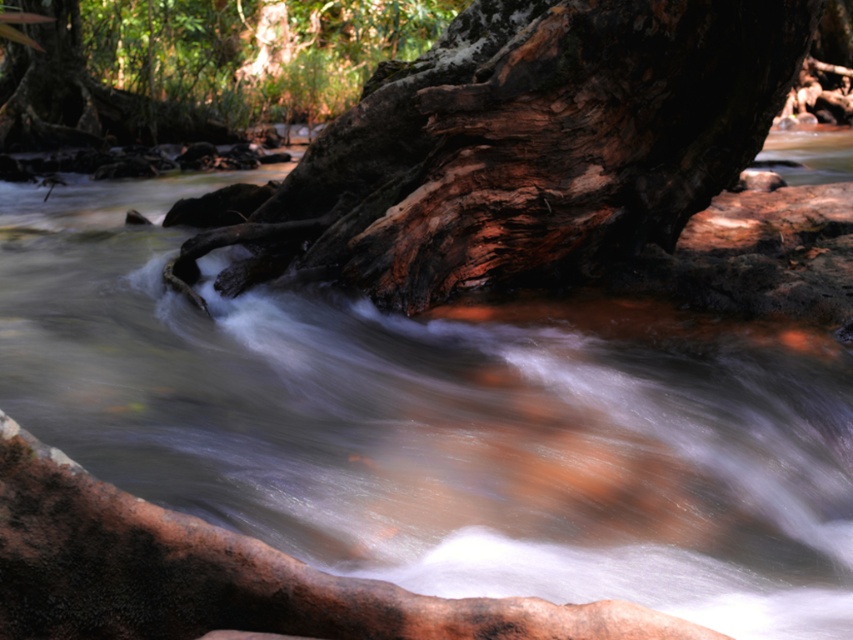
How distant is rough bark tree trunk at center from smooth bark tree at upper left?

rough bark tree trunk at center and smooth bark tree at upper left are 15.11 meters apart.

Is point (421, 250) farther from viewer compared to point (155, 113)?

That is False.

Image resolution: width=853 pixels, height=640 pixels. What are the coordinates of `rough bark tree trunk at center` in the screenshot? It's located at (520, 147).